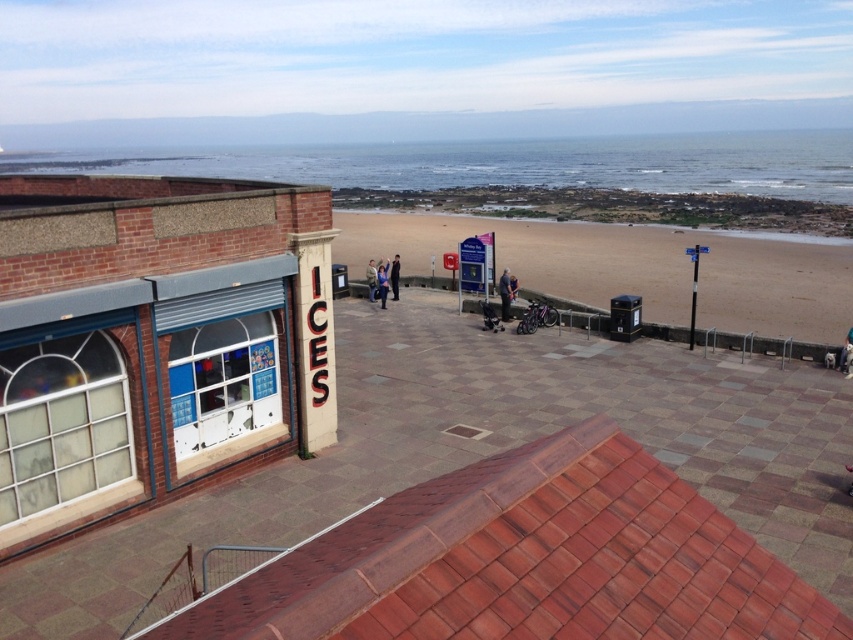
Consider the image. Between blue water at upper center and blue denim jeans at center, which one appears on the left side from the viewer's perspective?

blue water at upper center is more to the left.

Describe the element at coordinates (509, 163) in the screenshot. I see `blue water at upper center` at that location.

Where is `blue water at upper center`? blue water at upper center is located at coordinates (509, 163).

Describe the element at coordinates (631, 268) in the screenshot. I see `brown sand at center` at that location.

Identify the location of brown sand at center. This screenshot has width=853, height=640. (631, 268).

Which is behind, point (436, 260) or point (505, 305)?

Positioned behind is point (436, 260).

The width and height of the screenshot is (853, 640). In order to click on brown sand at center in this screenshot , I will do `click(631, 268)`.

Is blue water at upper center behind light blue denim jacket at center?

Yes.

Is blue water at upper center positioned before light blue denim jacket at center?

No, it is not.

Where is `blue water at upper center`? The height and width of the screenshot is (640, 853). blue water at upper center is located at coordinates click(x=509, y=163).

The height and width of the screenshot is (640, 853). I want to click on blue water at upper center, so click(509, 163).